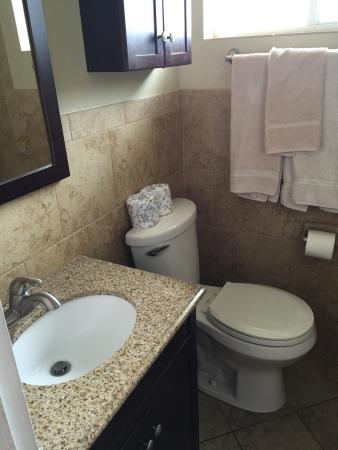
Find the location of a particular element. The width and height of the screenshot is (338, 450). toilet seat is located at coordinates (239, 300).